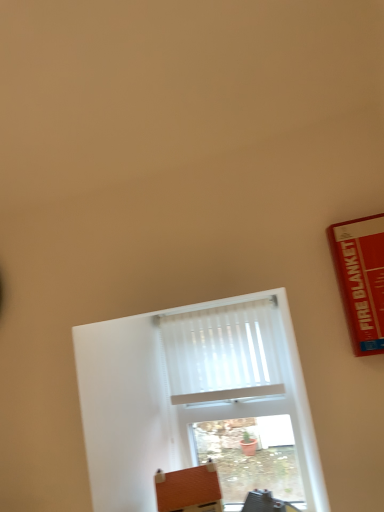
Question: Is white matte window at center bigger or smaller than white pleated curtain at center?

Choices:
 (A) big
 (B) small

Answer: (A)

Question: Considering the positions of point (129, 321) and point (251, 371), is point (129, 321) closer or farther from the camera than point (251, 371)?

Choices:
 (A) closer
 (B) farther

Answer: (B)

Question: Which of these objects is positioned closest to the white matte window at center?

Choices:
 (A) white pleated curtain at center
 (B) brown leather cushion at lower center

Answer: (A)

Question: Which object is the closest to the brown leather cushion at lower center?

Choices:
 (A) white matte window at center
 (B) white pleated curtain at center

Answer: (A)